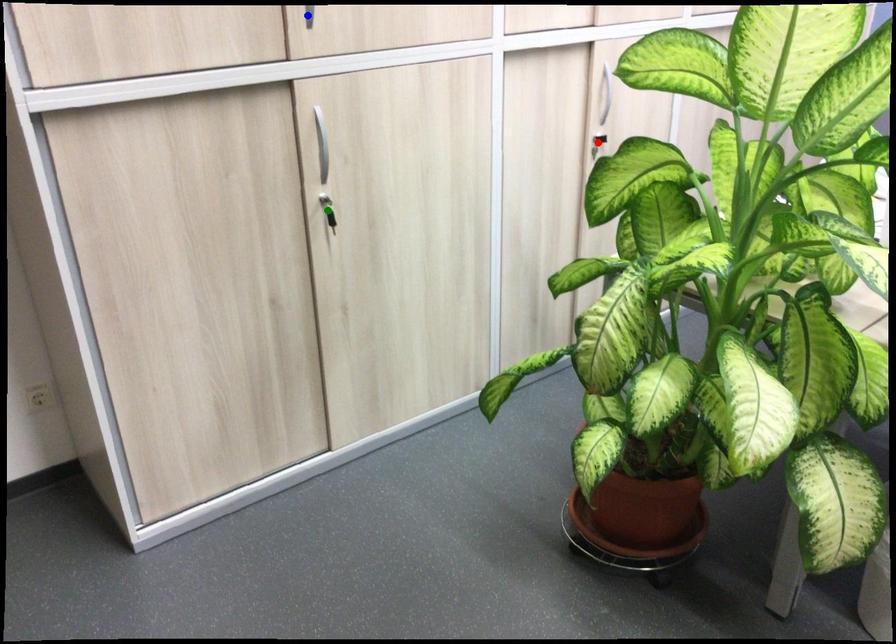
Order these from nearest to farthest:
1. green point
2. blue point
3. red point

red point
green point
blue point